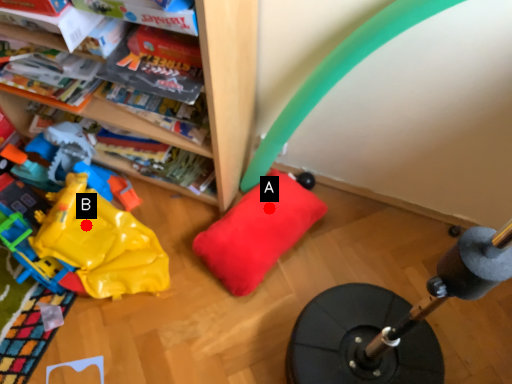
Question: Two points are circled on the image, labeled by A and B beside each circle. Which point is closer to the camera taking this photo?

Choices:
 (A) A is closer
 (B) B is closer

Answer: (B)